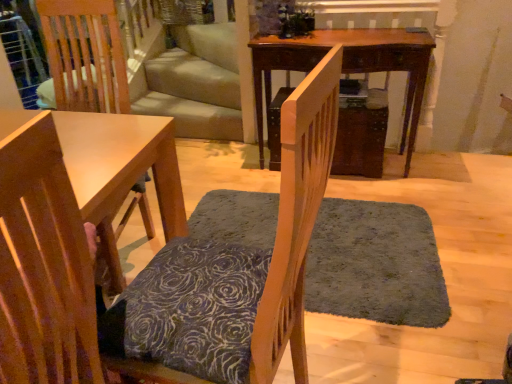
Question: From the image's perspective, is mahogany wood table at center positioned above or below wooden chair with patterned cushion at center, acting as the second chair starting from the left?

Choices:
 (A) above
 (B) below

Answer: (A)

Question: Is point (372, 41) closer or farther from the camera than point (311, 145)?

Choices:
 (A) farther
 (B) closer

Answer: (A)

Question: Which is farther from the wooden chair with patterned cushion at center, which appears as the 1th chair when viewed from the right?

Choices:
 (A) wooden chair at lower left, arranged as the second chair when viewed from the right
 (B) mahogany wood table at center
 (C) dark gray shaggy rug at center

Answer: (B)

Question: Estimate the real-world distances between objects in this image. Which object is farther from the wooden chair at lower left, arranged as the second chair when viewed from the right?

Choices:
 (A) wooden chair with patterned cushion at center, which appears as the 1th chair when viewed from the right
 (B) mahogany wood table at center
 (C) dark gray shaggy rug at center

Answer: (B)